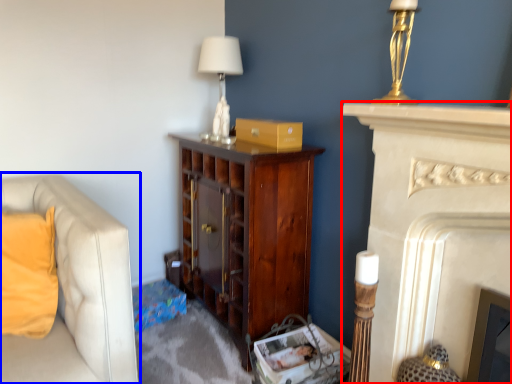
Question: Which object is further to the camera taking this photo, fireplace (highlighted by a red box) or studio couch (highlighted by a blue box)?

Choices:
 (A) fireplace
 (B) studio couch

Answer: (B)